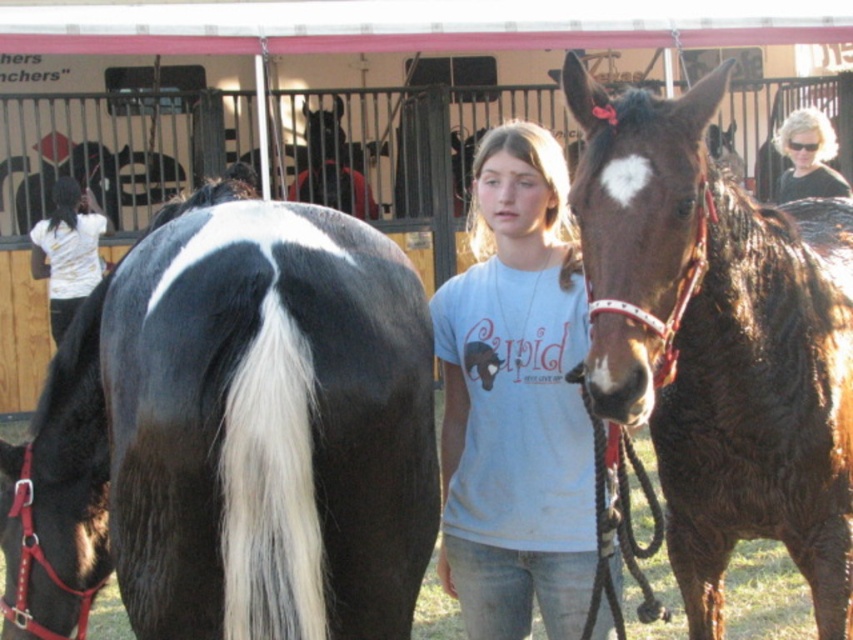
You are a photographer taking a picture of the light blue cotton shirt at center and the blonde hair at upper right. Which object is taller in the photo?

The light blue cotton shirt at center is taller than the blonde hair at upper right.